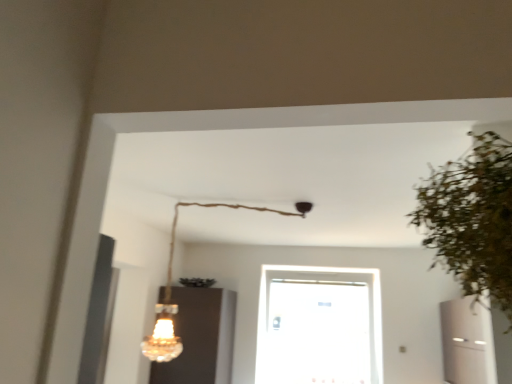
Question: Considering the relative positions of crystal glass chandelier at upper center and white glossy air conditioner at right in the image provided, is crystal glass chandelier at upper center behind white glossy air conditioner at right?

Choices:
 (A) no
 (B) yes

Answer: (A)

Question: Does crystal glass chandelier at upper center have a larger size compared to white glossy air conditioner at right?

Choices:
 (A) no
 (B) yes

Answer: (A)

Question: From the image's perspective, does crystal glass chandelier at upper center appear lower than white glossy air conditioner at right?

Choices:
 (A) yes
 (B) no

Answer: (B)

Question: Is crystal glass chandelier at upper center thinner than white glossy air conditioner at right?

Choices:
 (A) no
 (B) yes

Answer: (A)

Question: Could you tell me if crystal glass chandelier at upper center is turned towards white glossy air conditioner at right?

Choices:
 (A) yes
 (B) no

Answer: (B)

Question: Can you confirm if crystal glass chandelier at upper center is smaller than white glossy air conditioner at right?

Choices:
 (A) no
 (B) yes

Answer: (B)

Question: Considering the relative sizes of transparent glass door at center and crystal glass chandelier at upper center in the image provided, is transparent glass door at center taller than crystal glass chandelier at upper center?

Choices:
 (A) no
 (B) yes

Answer: (B)

Question: Could you tell me if transparent glass door at center is turned towards crystal glass chandelier at upper center?

Choices:
 (A) no
 (B) yes

Answer: (B)

Question: Is transparent glass door at center next to crystal glass chandelier at upper center?

Choices:
 (A) yes
 (B) no

Answer: (B)

Question: Can you confirm if transparent glass door at center is wider than crystal glass chandelier at upper center?

Choices:
 (A) no
 (B) yes

Answer: (A)

Question: Is transparent glass door at center turned away from crystal glass chandelier at upper center?

Choices:
 (A) yes
 (B) no

Answer: (B)

Question: Does transparent glass door at center have a smaller size compared to crystal glass chandelier at upper center?

Choices:
 (A) yes
 (B) no

Answer: (B)

Question: From a real-world perspective, is green leafy plant at right physically below matte glass cabinet at lower left?

Choices:
 (A) yes
 (B) no

Answer: (B)